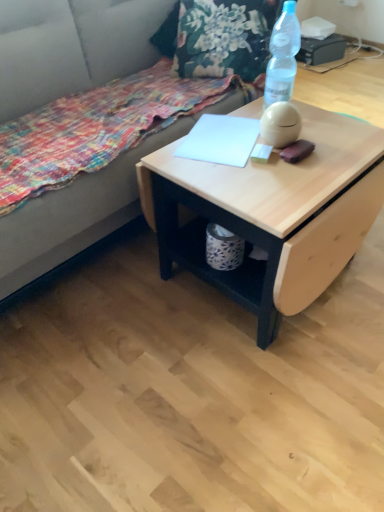
Locate an element on the screen. free space on the front side of white paper at center is located at coordinates (236, 180).